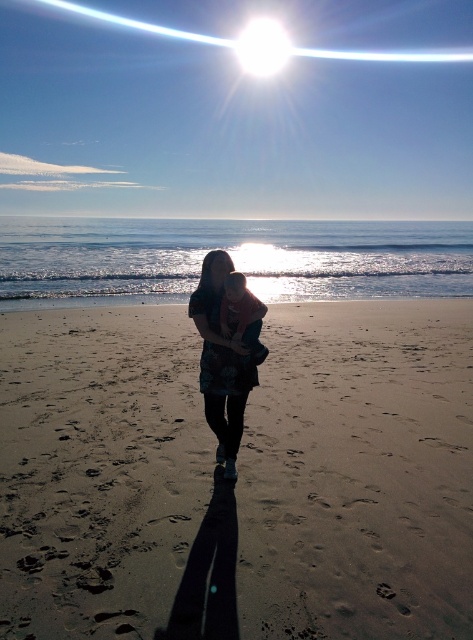
You are a photographer trying to capture a clear shot of the soft pink fabric baby at center and the sandy brown at center. Which object should you focus on first to ensure both are in focus?

You should focus on the sandy brown at center first since it is closer to the viewer, and then adjust focus to the soft pink fabric baby at center to ensure both are in focus.

You are standing on the beach and want to place a 3 feet wide beach umbrella. The sandy brown at center is the spot you want to set it. Will the umbrella fit without overlapping the sandy brown area?

The sandy brown at center is 9.59 feet away from viewer. Since the umbrella is 3 feet wide, it can be placed at the sandy brown area without overlapping as there is sufficient space.

You are a photographer trying to capture a clear image of the matte blue dress at center and the soft pink fabric baby at center. Considering the glare from the sun, which object might be easier to focus on and why?

The matte blue dress at center is larger in size than the soft pink fabric baby at center, so it might be easier to focus on due to its larger size providing more distinct edges and details for the camera to lock onto.